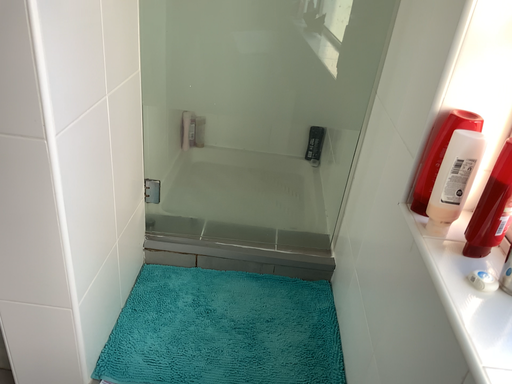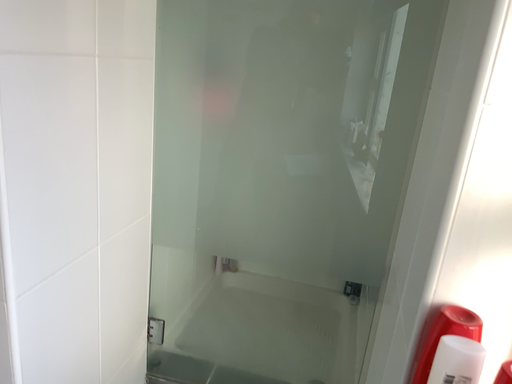
Question: Which way did the camera rotate in the video?

Choices:
 (A) rotated downward
 (B) rotated upward

Answer: (B)